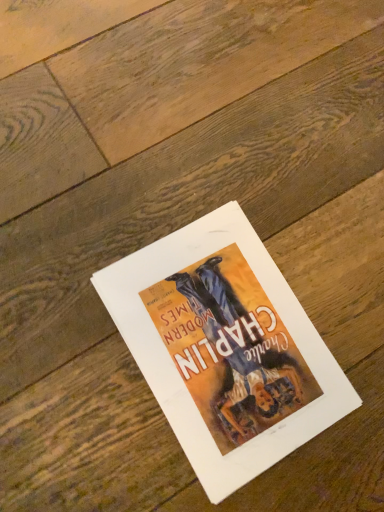
This screenshot has height=512, width=384. What do you see at coordinates (225, 348) in the screenshot?
I see `matte paper poster at center` at bounding box center [225, 348].

Find the location of a particular element. matte paper poster at center is located at coordinates (225, 348).

I want to click on matte paper poster at center, so click(225, 348).